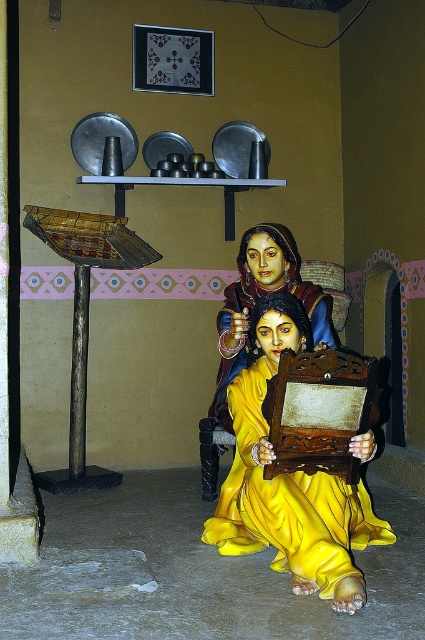
Question: Can you confirm if yellow satin fabric at center is positioned to the left of satin yellow dress at center?

Choices:
 (A) yes
 (B) no

Answer: (B)

Question: Which object appears farthest from the camera in this image?

Choices:
 (A) satin yellow dress at center
 (B) yellow satin fabric at center

Answer: (A)

Question: Can you confirm if yellow satin fabric at center is positioned to the left of satin yellow dress at center?

Choices:
 (A) no
 (B) yes

Answer: (A)

Question: Which point appears farthest from the camera in this image?

Choices:
 (A) (334, 522)
 (B) (229, 308)

Answer: (B)

Question: Does yellow satin fabric at center have a larger size compared to satin yellow dress at center?

Choices:
 (A) yes
 (B) no

Answer: (A)